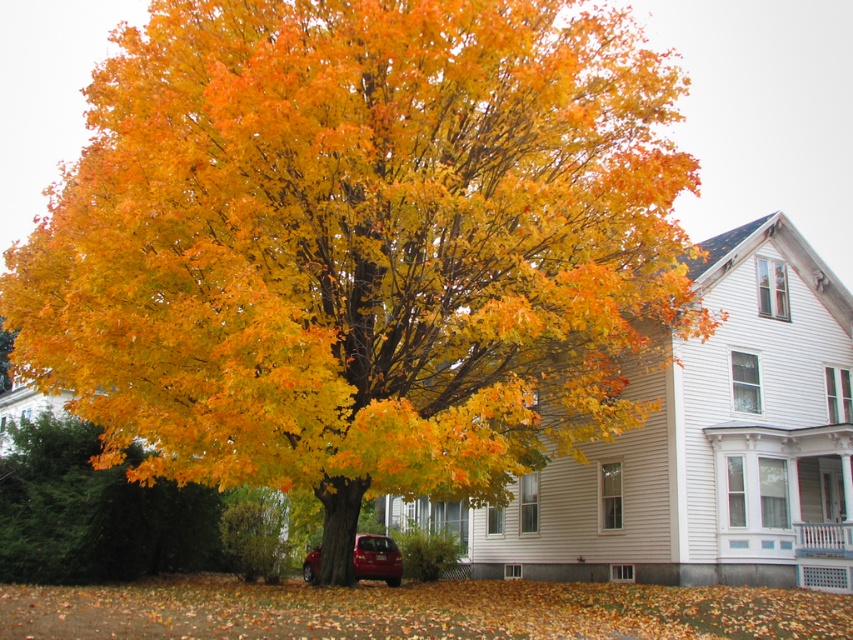
Can you confirm if golden yellow leaves at lower left is taller than shiny red sedan at lower center?

Yes.

Can you confirm if golden yellow leaves at lower left is positioned to the right of shiny red sedan at lower center?

No, golden yellow leaves at lower left is not to the right of shiny red sedan at lower center.

Which is behind, point (71, 454) or point (381, 544)?

The point (381, 544) is behind.

Identify the location of golden yellow leaves at lower left. The image size is (853, 640). (94, 512).